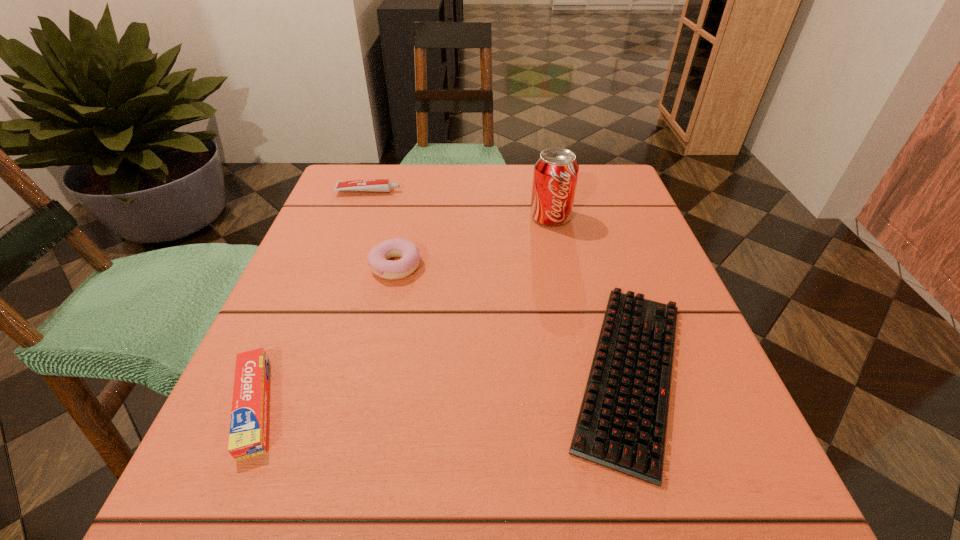
The width and height of the screenshot is (960, 540). I want to click on the tallest object, so click(556, 170).

This screenshot has height=540, width=960. Find the location of `the fourth nearest object`. the fourth nearest object is located at coordinates (556, 170).

Locate an element on the screen. This screenshot has height=540, width=960. the third farthest object is located at coordinates (377, 259).

The width and height of the screenshot is (960, 540). Find the location of `the fourth shortest object`. the fourth shortest object is located at coordinates (377, 259).

The width and height of the screenshot is (960, 540). I want to click on the farther toothpaste, so click(378, 185).

The image size is (960, 540). Find the location of `the nearer toothpaste`. the nearer toothpaste is located at coordinates (248, 427).

Identify the location of the shortest object. (622, 422).

Locate an element on the screen. free location located on the front of the tallest object is located at coordinates (560, 263).

In order to click on free space located 0.100m on the back of the doughnut in this screenshot , I will do `click(405, 221)`.

Image resolution: width=960 pixels, height=540 pixels. I want to click on vacant area situated at the nozzle of the farther toothpaste, so click(561, 191).